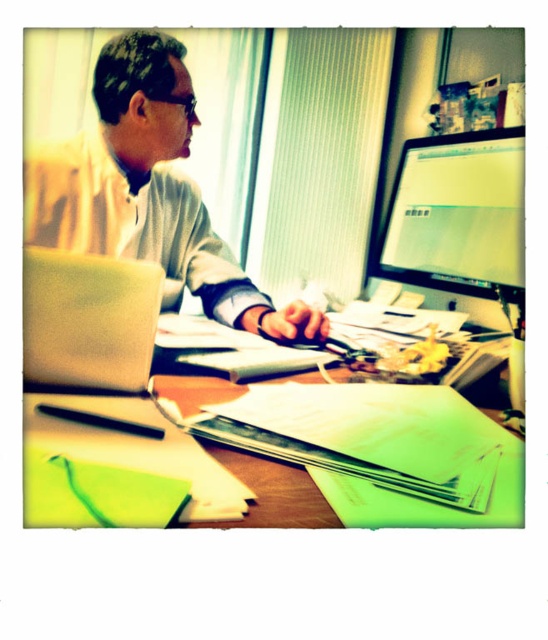
Question: Is matte plastic monitor at upper right above black plastic glasses at upper center?

Choices:
 (A) no
 (B) yes

Answer: (A)

Question: Which object is positioned closest to the black plastic glasses at upper center?

Choices:
 (A) wooden desk at center
 (B) matte plastic monitor at upper right
 (C) matte green laptop at left
 (D) matte gray sweater at center

Answer: (D)

Question: Which point is farther to the camera?

Choices:
 (A) (224, 388)
 (B) (37, 323)
 (C) (456, 195)

Answer: (C)

Question: Which of the following is the farthest from the observer?

Choices:
 (A) (37, 328)
 (B) (163, 216)
 (C) (88, 426)

Answer: (B)

Question: Can you confirm if wooden desk at center is positioned to the right of matte plastic monitor at upper right?

Choices:
 (A) no
 (B) yes

Answer: (A)

Question: Can you confirm if matte gray sweater at center is positioned to the left of black matte pen at lower center?

Choices:
 (A) no
 (B) yes

Answer: (B)